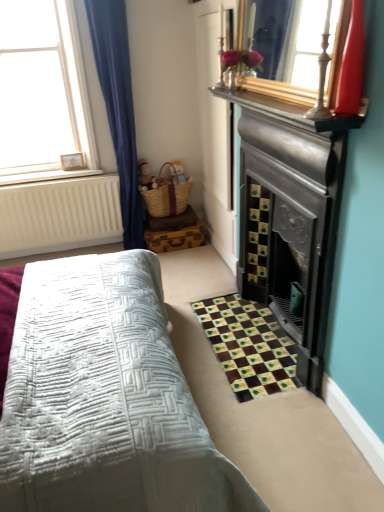
Question: Considering the relative sizes of white wooden frame at upper left and shiny red glass vase at upper right in the image provided, is white wooden frame at upper left taller than shiny red glass vase at upper right?

Choices:
 (A) yes
 (B) no

Answer: (A)

Question: Is white wooden frame at upper left to the left of shiny red glass vase at upper right from the viewer's perspective?

Choices:
 (A) no
 (B) yes

Answer: (B)

Question: Does white wooden frame at upper left have a lesser width compared to shiny red glass vase at upper right?

Choices:
 (A) yes
 (B) no

Answer: (B)

Question: From the image's perspective, is white wooden frame at upper left located above shiny red glass vase at upper right?

Choices:
 (A) yes
 (B) no

Answer: (A)

Question: Is white wooden frame at upper left further to camera compared to shiny red glass vase at upper right?

Choices:
 (A) yes
 (B) no

Answer: (A)

Question: Is point (67, 160) positioned closer to the camera than point (62, 112)?

Choices:
 (A) farther
 (B) closer

Answer: (A)

Question: Based on their sizes in the image, would you say wooden picture frame at upper left is bigger or smaller than white wooden frame at upper left?

Choices:
 (A) big
 (B) small

Answer: (B)

Question: Is wooden picture frame at upper left spatially inside white wooden frame at upper left, or outside of it?

Choices:
 (A) inside
 (B) outside

Answer: (A)

Question: Considering their positions, is wooden picture frame at upper left located in front of or behind white wooden frame at upper left?

Choices:
 (A) behind
 (B) front

Answer: (A)

Question: Relative to wooden picture frame at upper left, is shiny red glass vase at upper right in front or behind?

Choices:
 (A) behind
 (B) front

Answer: (B)

Question: Considering the positions of shiny red glass vase at upper right and wooden picture frame at upper left in the image, is shiny red glass vase at upper right bigger or smaller than wooden picture frame at upper left?

Choices:
 (A) small
 (B) big

Answer: (B)

Question: From the image's perspective, is shiny red glass vase at upper right above or below wooden picture frame at upper left?

Choices:
 (A) below
 (B) above

Answer: (A)

Question: Is point (352, 6) closer or farther from the camera than point (72, 160)?

Choices:
 (A) closer
 (B) farther

Answer: (A)

Question: Relative to shiny red glass vase at upper right, is brown fabric rug at lower right in front or behind?

Choices:
 (A) front
 (B) behind

Answer: (B)

Question: Based on their positions, is brown fabric rug at lower right located to the left or right of shiny red glass vase at upper right?

Choices:
 (A) right
 (B) left

Answer: (B)